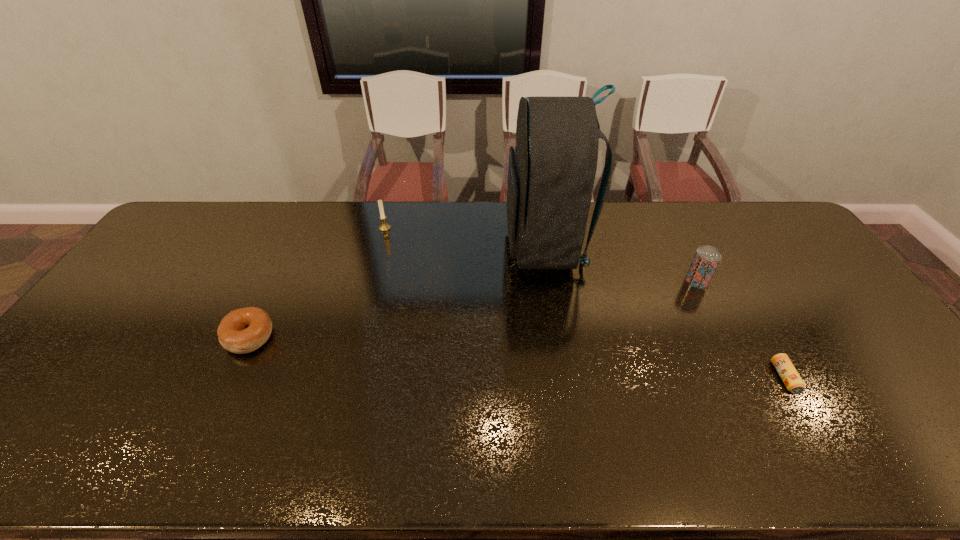
Image resolution: width=960 pixels, height=540 pixels. In order to click on free point at the left edge in this screenshot , I will do `click(139, 322)`.

Identify the location of blank space at the right edge of the desktop. (763, 256).

Identify the location of vacant area between the candle holder and the rightmost object. click(585, 303).

Where is `free space between the second object from right to left and the fourth farthest object`? free space between the second object from right to left and the fourth farthest object is located at coordinates (473, 309).

You are a GUI agent. You are given a task and a screenshot of the screen. Output one action in this format:
    pyautogui.click(x=<x>, y=<y>)
    Task: Click on the blank region between the left beer can and the fourth tallest object
    This screenshot has width=960, height=540.
    Given the screenshot: What is the action you would take?
    pyautogui.click(x=473, y=309)

Identify the location of unoccupied area between the shorter beer can and the candle holder. (585, 303).

The image size is (960, 540). I want to click on vacant area that lies between the candle holder and the tallest object, so click(x=465, y=237).

The height and width of the screenshot is (540, 960). Find the location of `vacant space in between the second shortest object and the shortest object`. vacant space in between the second shortest object and the shortest object is located at coordinates (516, 357).

Where is `vacant point located between the nearer beer can and the taller beer can`? vacant point located between the nearer beer can and the taller beer can is located at coordinates (741, 329).

Locate an element on the screen. The width and height of the screenshot is (960, 540). free space between the leftmost object and the rightmost object is located at coordinates (516, 357).